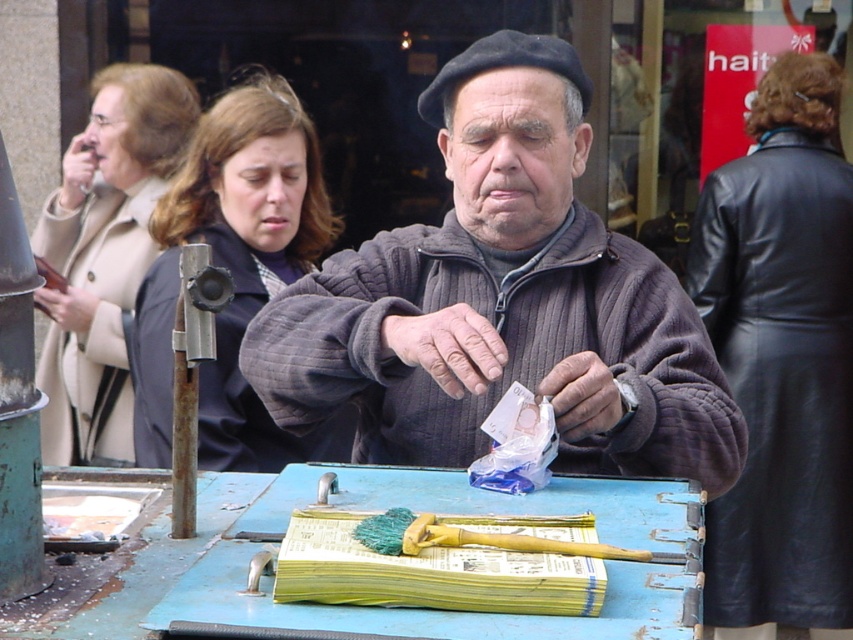
Question: Can you confirm if dark gray sweater at center is positioned to the right of beige wool coat at upper left?

Choices:
 (A) yes
 (B) no

Answer: (A)

Question: Among these points, which one is nearest to the camera?

Choices:
 (A) (222, 604)
 (B) (115, 436)
 (C) (442, 339)

Answer: (A)

Question: Can you confirm if blue painted wood table at center is positioned below beige wool coat at upper left?

Choices:
 (A) yes
 (B) no

Answer: (A)

Question: Which of these objects is positioned farthest from the dark brown hair at center?

Choices:
 (A) beige wool coat at upper left
 (B) black leather coat at upper right
 (C) blue painted wood table at center
 (D) dark gray sweater at center

Answer: (C)

Question: Which point appears closest to the camera in this image?

Choices:
 (A) (103, 108)
 (B) (480, 182)
 (C) (418, 509)
 (D) (236, 276)

Answer: (C)

Question: Considering the relative positions of dark gray sweater at center and blue painted wood table at center in the image provided, where is dark gray sweater at center located with respect to blue painted wood table at center?

Choices:
 (A) left
 (B) right

Answer: (B)